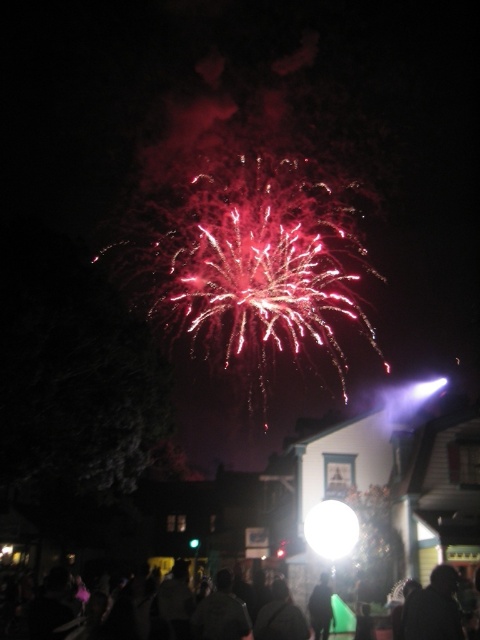
You are standing in the crowd watching the fireworks. There is a bright white sphere at the center of the sky. Where is the point at coordinates point (331, 529) located?

The point at coordinates point (331, 529) is located on the bright white sphere at center.

You are a photographer trying to capture the fireworks display. You have a camera with a fixed focus on the bright white sphere at center. Considering the black matte person at lower right, will their silhouette be in focus if you take the photo now?

The black matte person at lower right has a lesser height compared to bright white sphere at center. Since the camera is focused on the bright white sphere at center, the black matte person at lower right may not be in focus as they are closer to the camera and the focus is set on the distant bright white sphere at center.

From the picture: You are a photographer trying to capture the fireworks display. You notice the bright white sphere at center and the black matte jacket at lower center in your frame. Which object appears closer to you in the photo?

The bright white sphere at center appears closer to you because it is further to the viewer than the black matte jacket at lower center.